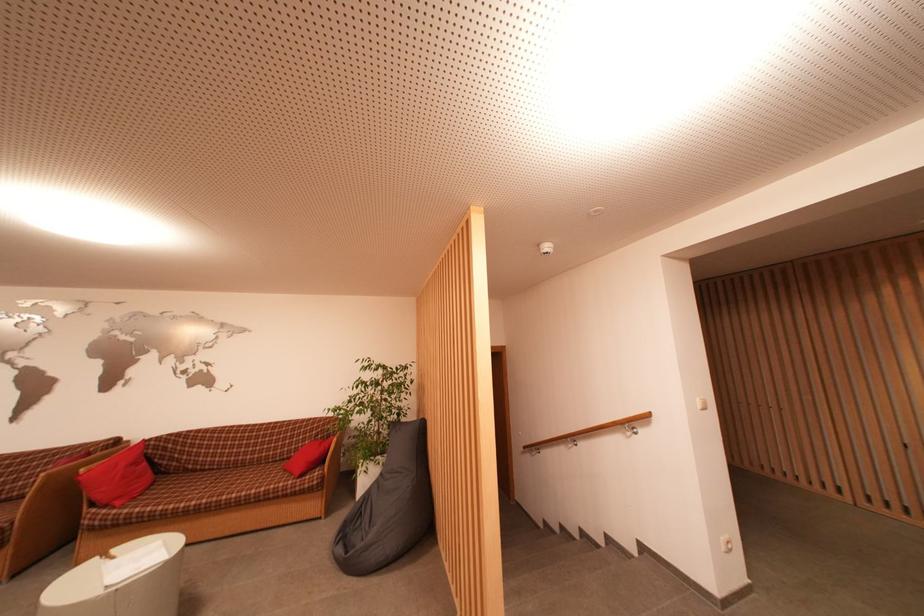
Find where to sit the sofa sitting surface. Please return your answer as a coordinate pair (x, y).

(226, 479)